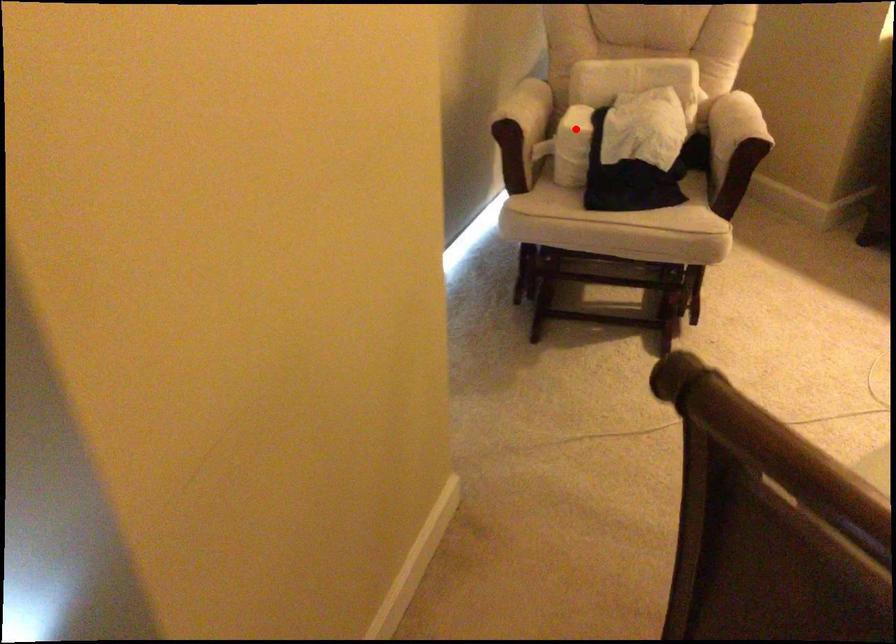
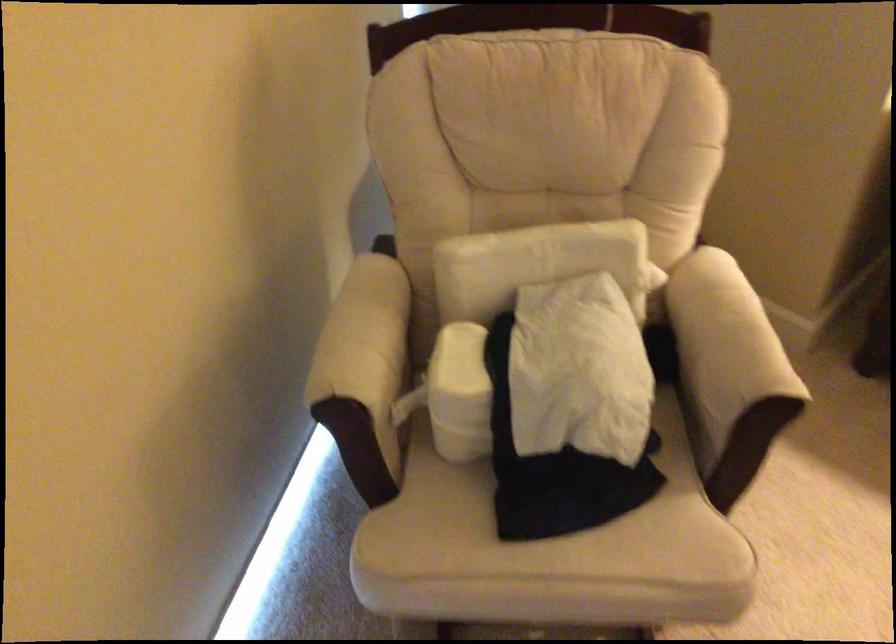
Question: A red point is marked in image1. In image2, is the corresponding 3D point closer to the camera or farther? Reply with the corresponding letter.

Choices:
 (A) The corresponding 3D point is closer.
 (B) The corresponding 3D point is farther.

Answer: (A)